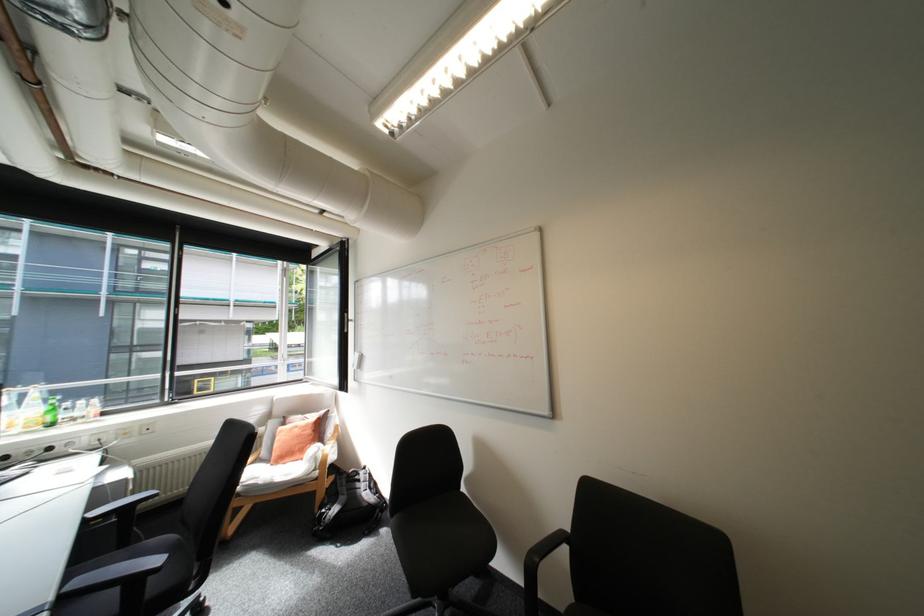
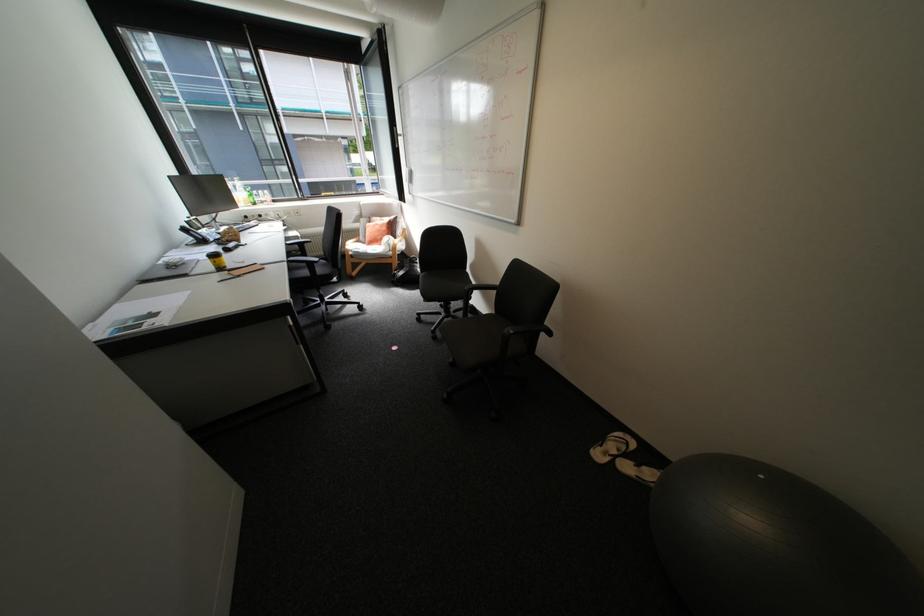
The point at (38, 427) is marked in the first image. Where is the corresponding point in the second image?

(256, 204)